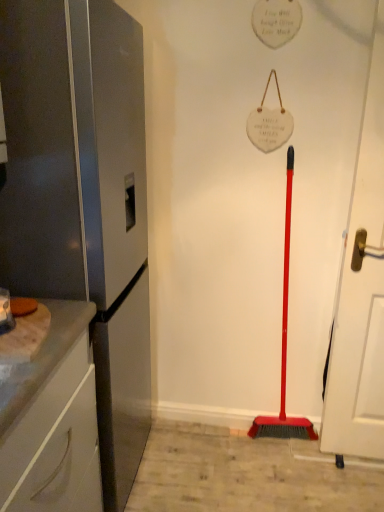
At what (x,y) coordinates should I click in order to perform the action: click on vacant area that is in front of white matte door at right. Please return your answer as a coordinate pair (x, y). This screenshot has width=384, height=512. Looking at the image, I should click on (355, 487).